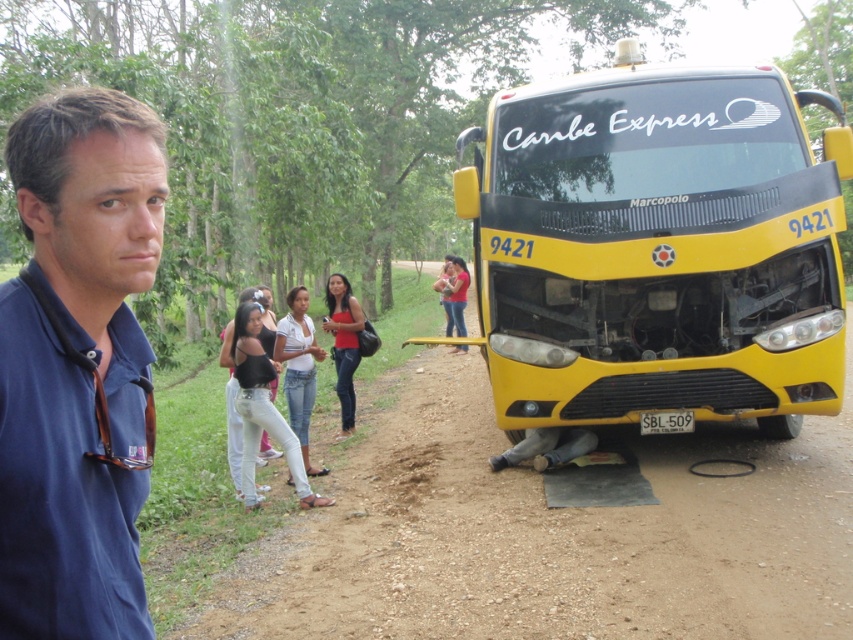
A photographer wants to take a picture of the scene from the camera position. They need to know if the point at coordinate point [264,596] is within the 10 meter range of the camera to ensure proper focus. Can you confirm if this point is within the 10 meter range?

The point at coordinate point [264,596] is 5.29 meters from the camera, which is within the 10 meter range. Therefore, the photographer can ensure proper focus.

You are standing in front of the yellow bus labeled Caribe Express 9421. There are two points marked in the scene. The first point is at coordinate point (x=552, y=385) and the second is at coordinate point (x=146, y=253). Which point is closer to you?

Point (x=552, y=385) is closer to you because it is further to the camera than point (x=146, y=253).